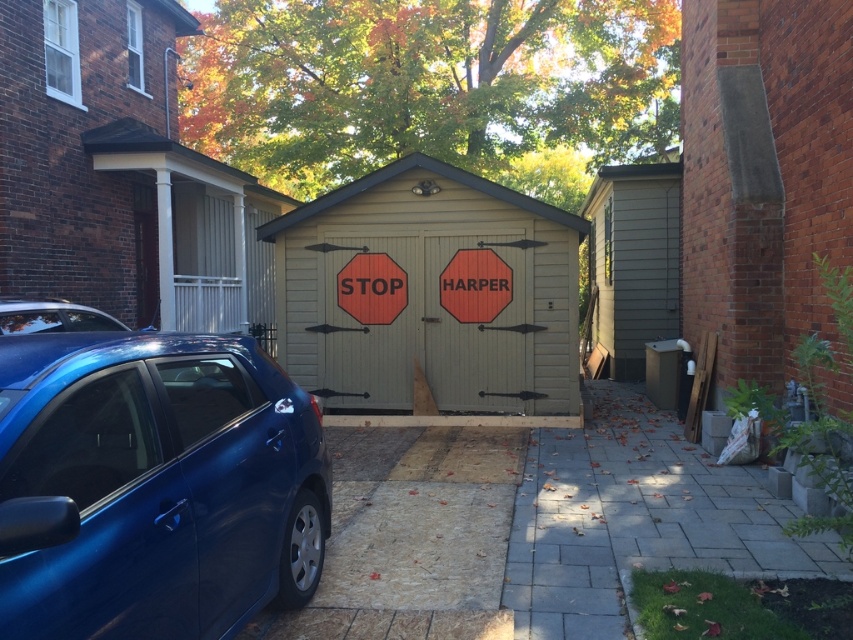
You are a delivery person trying to park your truck, which is 2 meters tall, in the driveway. The glossy blue car at lower left is parked there. Can your truck fit in the driveway without hitting the matte wood stop sign at center?

The glossy blue car at lower left is taller than the matte wood stop sign at center. Since your truck is 2 meters tall, you need to ensure there is enough clearance. If the stop sign is shorter than the car, the truck might hit the stop sign if it is lower than the truck. However, the description states the car is taller than the stop sign. Therefore, if the truck is 2 meters tall and the stop sign is shorter than that, the truck could potentially fit, but this requires knowing the stop sign height. The car

You are standing in front of the garage and want to place a small decoration. You have two points marked on the garage doors at coordinates point (143, 636) and point (405, 288). Which point is better to place the decoration if you want it to be closer to you?

Point (143, 636) is closer to the viewer than point (405, 288), so placing the decoration there would make it closer to you.

You are trying to park a new car that is 2 meters wide. The glossy blue car at lower left is currently parked next to the beige wood garage at center. Can your new car fit in the space between them?

The glossy blue car at lower left is thinner than the beige wood garage at center. Since your new car is 2 meters wide, you need to check the available space between them. However, without knowing the exact width of the glossy blue car at lower left or the distance from it to the garage, it is impossible to determine if the 2 meter wide car will fit.